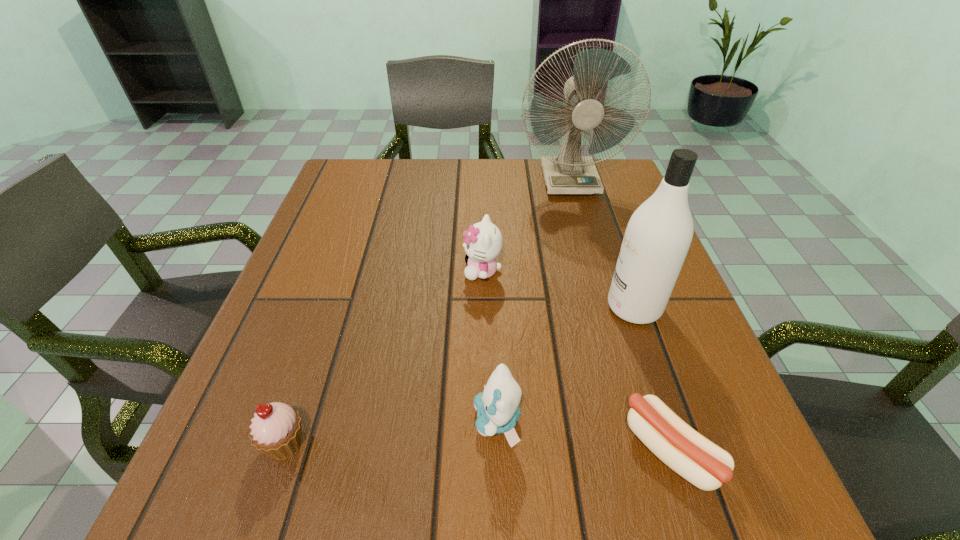
Locate an element on the screen. Image resolution: width=960 pixels, height=540 pixels. fan is located at coordinates (568, 173).

The image size is (960, 540). I want to click on shampoo, so click(x=657, y=238).

Where is `the fifth nearest object`? Image resolution: width=960 pixels, height=540 pixels. the fifth nearest object is located at coordinates (483, 243).

At what (x,y) coordinates should I click in order to perform the action: click on the nearer kitten. Please return your answer as a coordinate pair (x, y). Looking at the image, I should click on (497, 407).

Where is `cupcake`? The image size is (960, 540). cupcake is located at coordinates (276, 431).

Where is `the shortest object`? The width and height of the screenshot is (960, 540). the shortest object is located at coordinates (695, 458).

Locate an element on the screen. This screenshot has width=960, height=540. vacant space located 0.140m on the front-facing side of the fan is located at coordinates pyautogui.click(x=585, y=232).

Identify the location of free location located on the front-facing side of the shampoo. (575, 307).

You are a GUI agent. You are given a task and a screenshot of the screen. Output one action in this format:
    pyautogui.click(x=<x>, y=<y>)
    Task: Click on the blank area located on the front-facing side of the shampoo
    
    Given the screenshot: What is the action you would take?
    pyautogui.click(x=517, y=307)

The image size is (960, 540). Identify the location of free space located on the front-facing side of the shampoo. (475, 307).